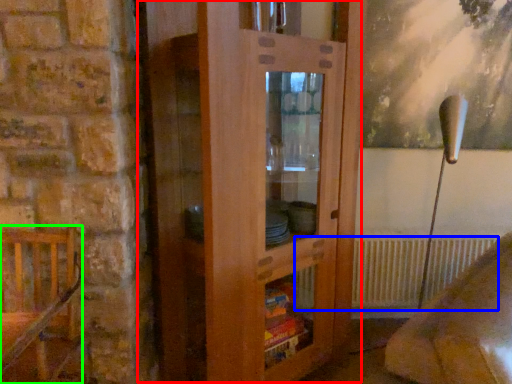
Question: Which object is the closest to the dresser (highlighted by a red box)? Choose among these: radiator (highlighted by a blue box) or furniture (highlighted by a green box).

Choices:
 (A) radiator
 (B) furniture

Answer: (B)